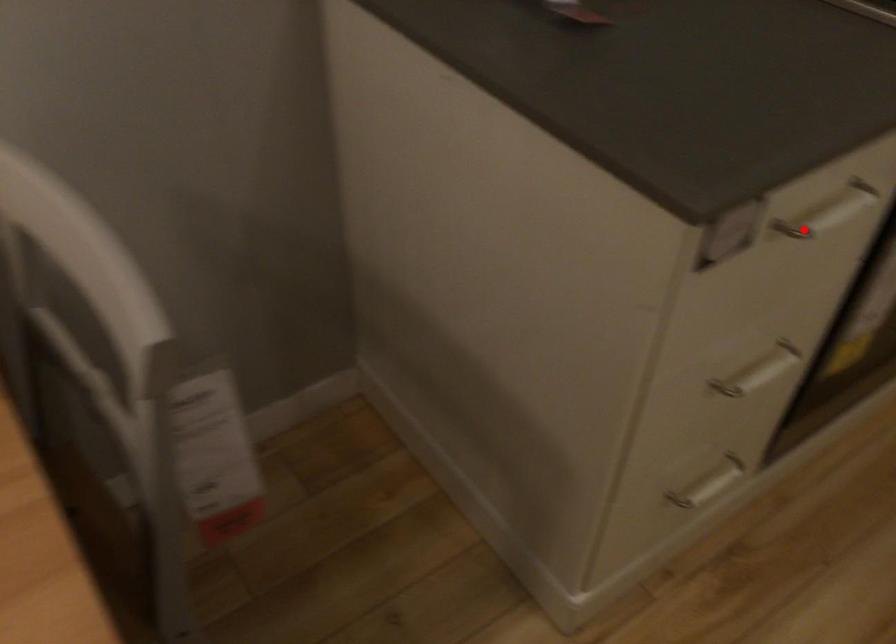
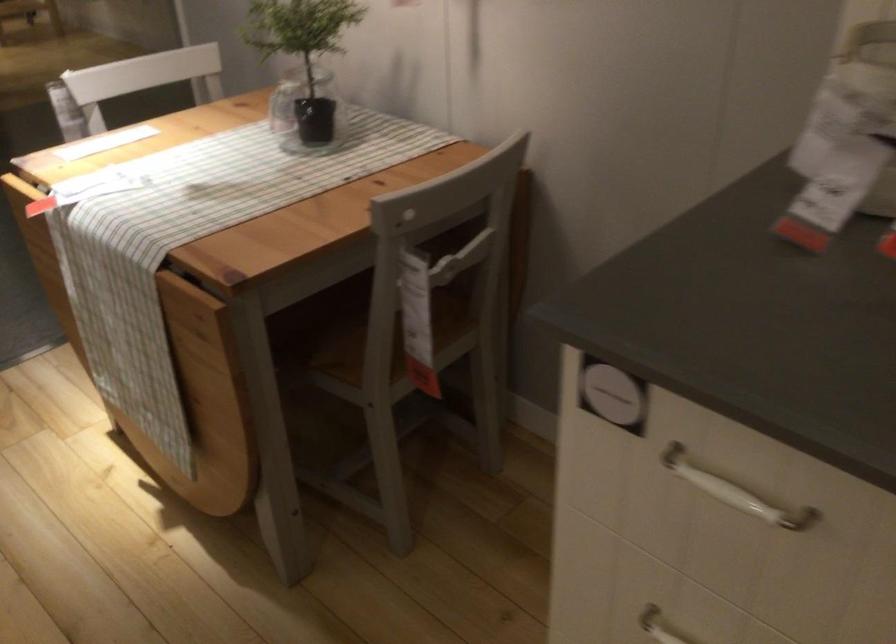
The point at the highlighted location is marked in the first image. Where is the corresponding point in the second image?

(734, 491)